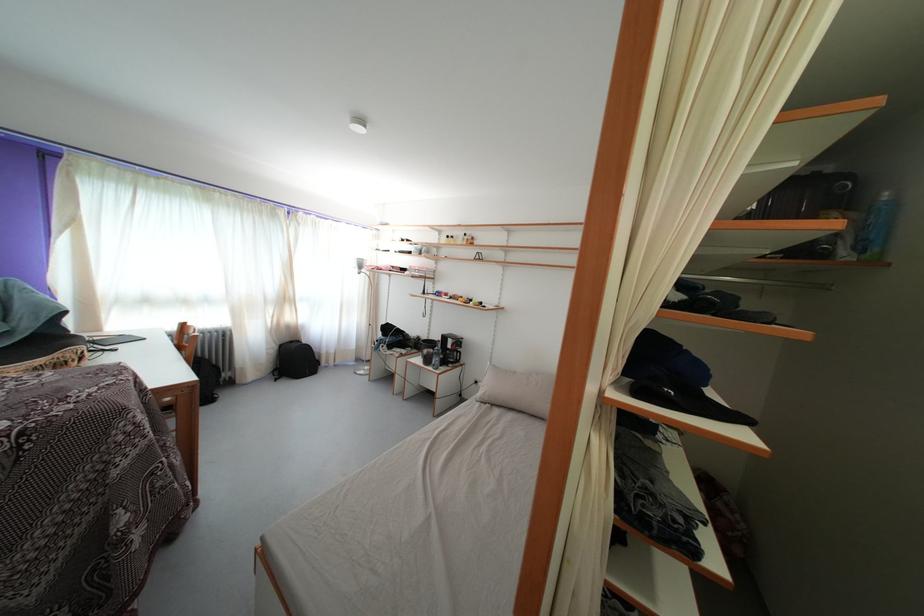
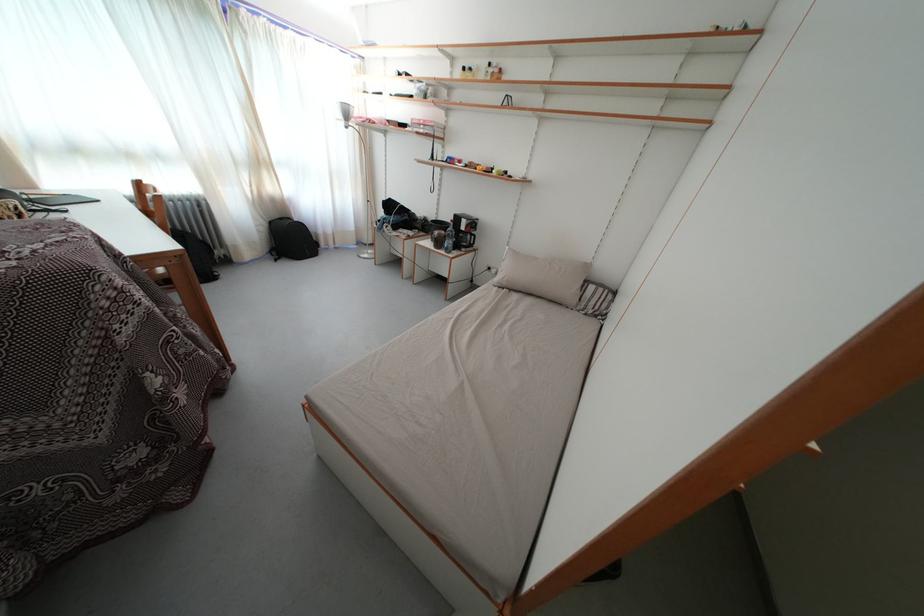
The point at [433,367] is marked in the first image. Where is the corresponding point in the second image?

(444, 249)